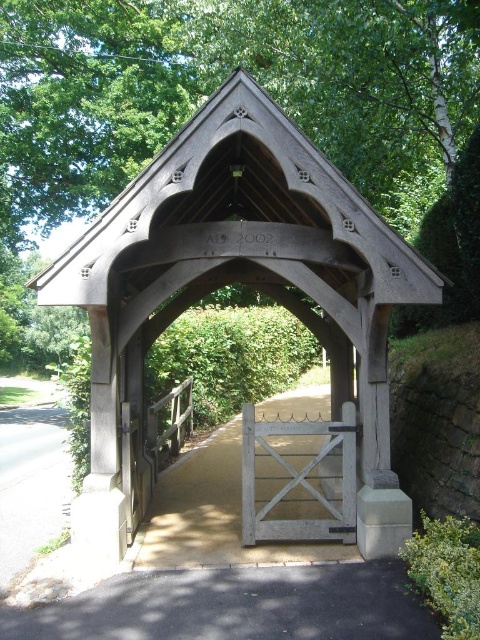
Is wooden gazebo at center positioned before white wooden gate at center?

Yes, it is.

Which is above, wooden gazebo at center or white wooden gate at center?

Positioned higher is wooden gazebo at center.

What do you see at coordinates (237, 282) in the screenshot? This screenshot has width=480, height=640. I see `wooden gazebo at center` at bounding box center [237, 282].

Locate an element on the screen. wooden gazebo at center is located at coordinates (237, 282).